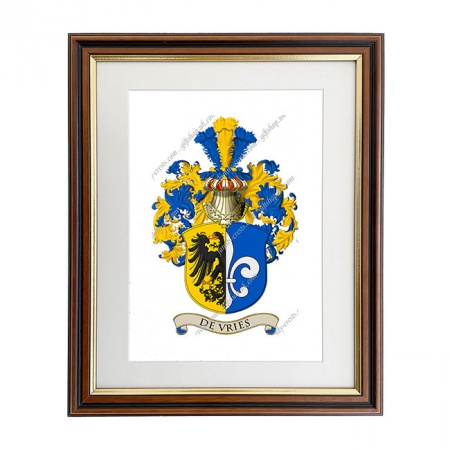
This screenshot has height=450, width=450. Find the location of `frame`. frame is located at coordinates (371, 276).